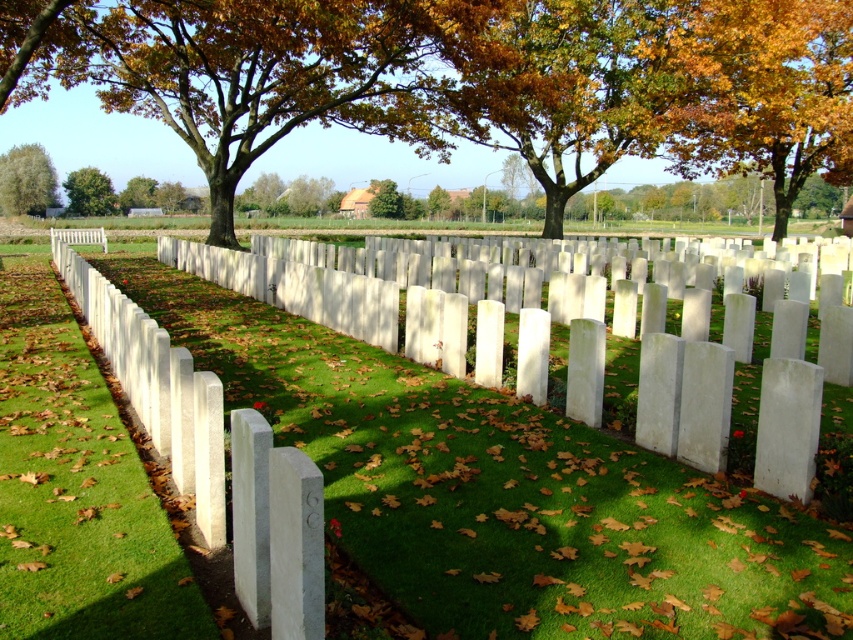
Question: Which object is positioned closest to the green leafy tree at left?

Choices:
 (A) golden leafy tree at upper right
 (B) brown leafy tree at center
 (C) white stone markers at center

Answer: (B)

Question: Estimate the real-world distances between objects in this image. Which object is farther from the brown leafy tree at center?

Choices:
 (A) green leafy tree at upper left
 (B) white stone markers at center
 (C) golden leafy tree at upper right

Answer: (B)

Question: Does brown leafy tree at upper center have a greater width compared to green leafy tree at left?

Choices:
 (A) yes
 (B) no

Answer: (A)

Question: Is white stone markers at center below green leafy tree at left?

Choices:
 (A) no
 (B) yes

Answer: (B)

Question: Which point is farther from the camera taking this photo?

Choices:
 (A) (747, 538)
 (B) (134, 198)
 (C) (732, 80)
 (D) (102, 189)

Answer: (B)

Question: Is brown leafy tree at upper center thinner than green leafy tree at left?

Choices:
 (A) yes
 (B) no

Answer: (B)